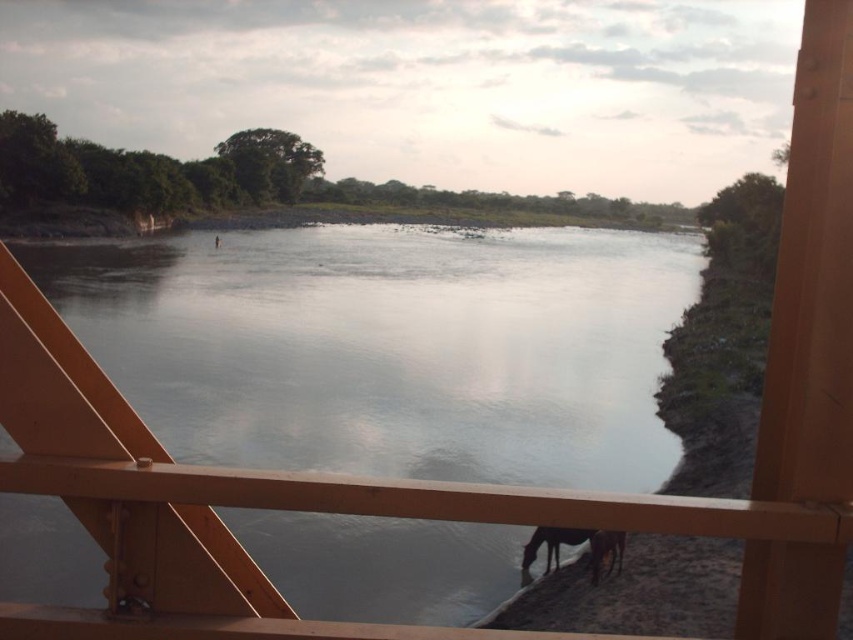
You are standing on the wooden structure and want to observe both the smooth water at center and the dark brown fur horse at lower right. Which object appears taller from your viewpoint?

The smooth water at center appears taller than the dark brown fur horse at lower right because it has a greater height compared to the horse.

You are a photographer standing on the wooden structure overlooking the river. You want to capture a photo of both the dark brown fur horse at lower right and the white glossy horse at lower right. However, you notice that one horse is blocking the view of the other. Which horse is blocking the other one?

The dark brown fur horse at lower right is positioned over the white glossy horse at lower right, so it is blocking the view of the white glossy horse at lower right.

Based on the scene description, what are the coordinates of the smooth water at center?

The smooth water at center is located at coordinates (389, 348).